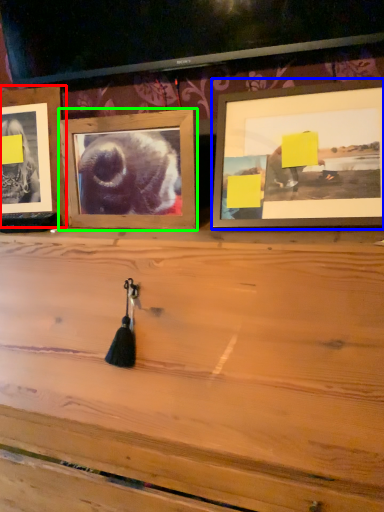
Question: Considering the real-world distances, which object is closest to picture frame (highlighted by a red box)? picture frame (highlighted by a blue box) or picture frame (highlighted by a green box).

Choices:
 (A) picture frame
 (B) picture frame

Answer: (B)